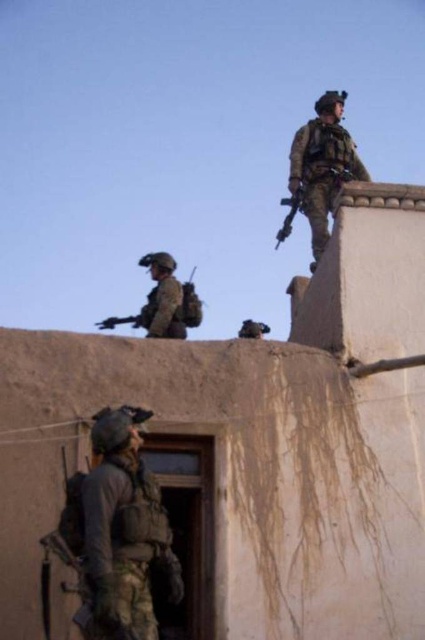
Can you confirm if camouflage fabric uniform at lower left is smaller than camouflage uniform at center?

Yes.

I want to click on camouflage fabric uniform at lower left, so click(124, 529).

Image resolution: width=425 pixels, height=640 pixels. What do you see at coordinates (124, 529) in the screenshot? I see `camouflage fabric uniform at lower left` at bounding box center [124, 529].

At what (x,y) coordinates should I click in order to perform the action: click on camouflage fabric uniform at lower left. Please return your answer as a coordinate pair (x, y). The image size is (425, 640). Looking at the image, I should click on (124, 529).

Consider the image. Does camouflage uniform at center have a larger size compared to matte black rifle at upper right?

Yes.

Is point (155, 266) closer to camera compared to point (283, 227)?

Yes, point (155, 266) is closer to viewer.

Find the location of a particular element. This screenshot has width=425, height=640. camouflage uniform at center is located at coordinates point(164,301).

Is camouflage fabric uniform at lower left to the right of camouflage uniform at upper right from the viewer's perspective?

Incorrect, camouflage fabric uniform at lower left is not on the right side of camouflage uniform at upper right.

Between camouflage fabric uniform at lower left and camouflage uniform at upper right, which one has less height?

camouflage fabric uniform at lower left is shorter.

Measure the distance between camouflage fabric uniform at lower left and camera.

A distance of 37.57 meters exists between camouflage fabric uniform at lower left and camera.

This screenshot has height=640, width=425. In order to click on camouflage fabric uniform at lower left in this screenshot , I will do `click(124, 529)`.